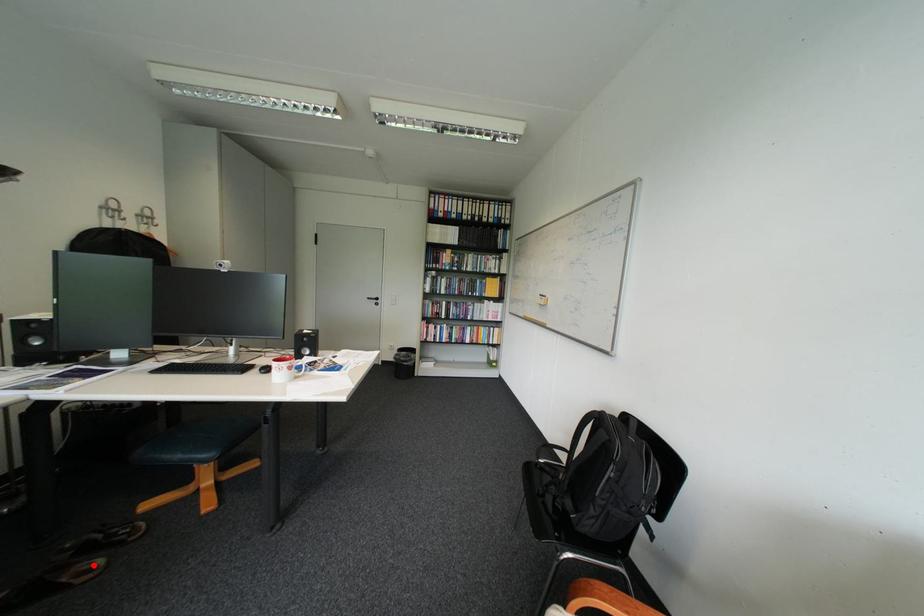
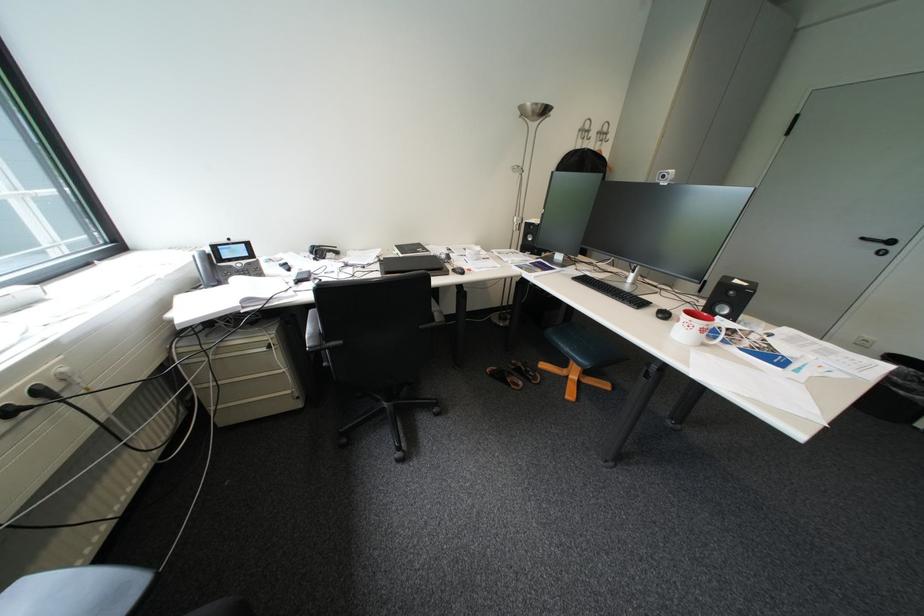
Question: I am providing you with two images of the same scene from different viewpoints. A red point is shown in image1. For the corresponding object point in image2, is it positioned nearer or farther from the camera?

Choices:
 (A) Nearer
 (B) Farther

Answer: (B)